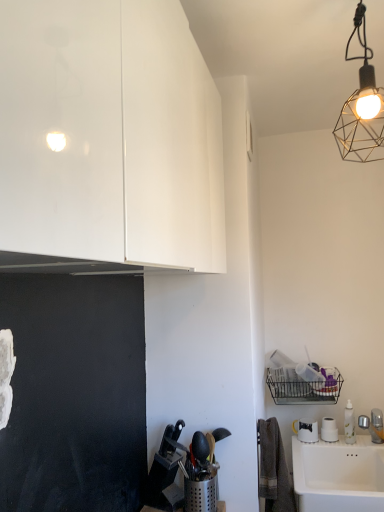
Question: Could you tell me if metallic wire mesh at upper right is facing glossy white cabinet at upper left?

Choices:
 (A) yes
 (B) no

Answer: (B)

Question: Is metallic wire mesh at upper right at the left side of glossy white cabinet at upper left?

Choices:
 (A) yes
 (B) no

Answer: (B)

Question: Is metallic wire mesh at upper right turned away from glossy white cabinet at upper left?

Choices:
 (A) yes
 (B) no

Answer: (B)

Question: Does metallic wire mesh at upper right touch glossy white cabinet at upper left?

Choices:
 (A) yes
 (B) no

Answer: (B)

Question: Is glossy white cabinet at upper left surrounded by metallic wire mesh at upper right?

Choices:
 (A) no
 (B) yes

Answer: (A)

Question: From a real-world perspective, does metallic wire mesh at upper right sit lower than glossy white cabinet at upper left?

Choices:
 (A) yes
 (B) no

Answer: (B)

Question: From a real-world perspective, is metallic wire mesh at upper right positioned over white ceramic sink at lower right based on gravity?

Choices:
 (A) yes
 (B) no

Answer: (A)

Question: Is the depth of metallic wire mesh at upper right greater than that of white ceramic sink at lower right?

Choices:
 (A) no
 (B) yes

Answer: (A)

Question: From the image's perspective, is metallic wire mesh at upper right located beneath white ceramic sink at lower right?

Choices:
 (A) yes
 (B) no

Answer: (B)

Question: From a real-world perspective, is metallic wire mesh at upper right located beneath white ceramic sink at lower right?

Choices:
 (A) yes
 (B) no

Answer: (B)

Question: Is metallic wire mesh at upper right facing away from white ceramic sink at lower right?

Choices:
 (A) no
 (B) yes

Answer: (A)

Question: Is metallic wire mesh at upper right at the right side of white ceramic sink at lower right?

Choices:
 (A) yes
 (B) no

Answer: (B)

Question: Is glossy white cabinet at upper left further to the viewer compared to metallic wire mesh at upper right?

Choices:
 (A) no
 (B) yes

Answer: (A)